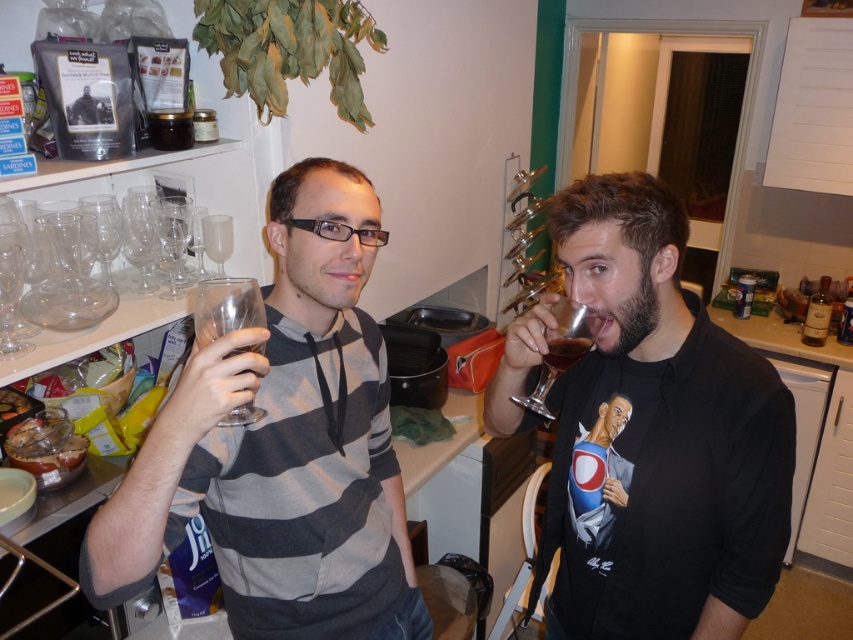
Question: Is matte black t-shirt at center to the left of clear glass wine glass at left from the viewer's perspective?

Choices:
 (A) yes
 (B) no

Answer: (B)

Question: Which of the following is the closest to the observer?

Choices:
 (A) translucent glass at right
 (B) clear glass wine glass at left
 (C) translucent glass wine glass at right

Answer: (B)

Question: Which point is closer to the camera?

Choices:
 (A) (581, 339)
 (B) (824, 289)
 (C) (39, 236)

Answer: (A)

Question: Is gray striped hoodie at center thinner than translucent glass bottle at right?

Choices:
 (A) yes
 (B) no

Answer: (B)

Question: Can you confirm if translucent glass wine glass at right is smaller than translucent glass at right?

Choices:
 (A) no
 (B) yes

Answer: (A)

Question: Which of the following is the farthest from the observer?

Choices:
 (A) (370, 515)
 (B) (561, 352)
 (C) (50, 244)

Answer: (C)